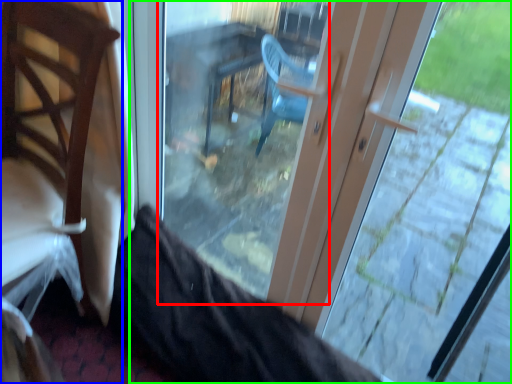
Question: Estimate the real-world distances between objects in this image. Which object is farther from glass door (highlighted by a red box), chair (highlighted by a blue box) or door (highlighted by a green box)?

Choices:
 (A) chair
 (B) door

Answer: (A)